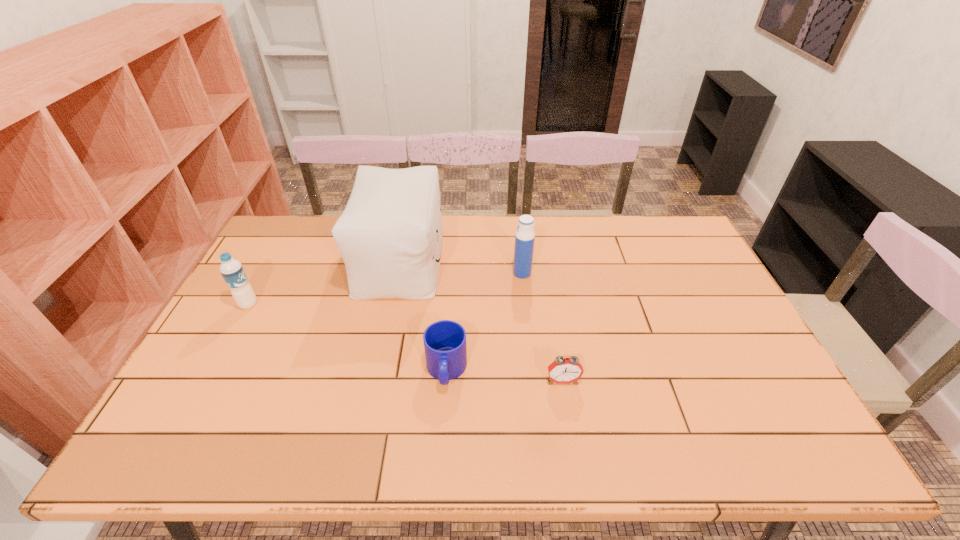
The width and height of the screenshot is (960, 540). What are the coordinates of `free space between the cushion and the leftmost object` in the screenshot? It's located at (324, 282).

Find the location of a particular element. This screenshot has height=540, width=960. free space between the rightmost object and the farther water bottle is located at coordinates (542, 327).

You are a GUI agent. You are given a task and a screenshot of the screen. Output one action in this format:
    pyautogui.click(x=<x>, y=<y>)
    Task: Click on the free space between the mug and the cushion
    
    Given the screenshot: What is the action you would take?
    pyautogui.click(x=423, y=315)

You are a GUI agent. You are given a task and a screenshot of the screen. Output one action in this format:
    pyautogui.click(x=<x>, y=<y>)
    Task: Click on the free space between the mug and the cushion
    This screenshot has height=540, width=960.
    Given the screenshot: What is the action you would take?
    pyautogui.click(x=423, y=315)

Where is `free space between the rightmost object and the tallest object`? The image size is (960, 540). free space between the rightmost object and the tallest object is located at coordinates (481, 320).

Locate an element on the screen. free space between the mug and the tallest object is located at coordinates (423, 315).

Identify the location of empty space that is in between the rightmost object and the nearer water bottle. (405, 342).

Identify which object is the third closest to the alarm clock. Please provide its 2D coordinates. Your answer should be formatted as a tuple, i.e. [(x, y)], where the tuple contains the x and y coordinates of a point satisfying the conditions above.

[(390, 234)]

Locate an element on the screen. The height and width of the screenshot is (540, 960). object that is the second nearest to the second object from right to left is located at coordinates (445, 348).

Identify the location of vacant area in the image that satisfies the following two spatial constraints: 1. on the back side of the right water bottle; 2. on the side of the cushion with the smiley face. This screenshot has width=960, height=540. (520, 260).